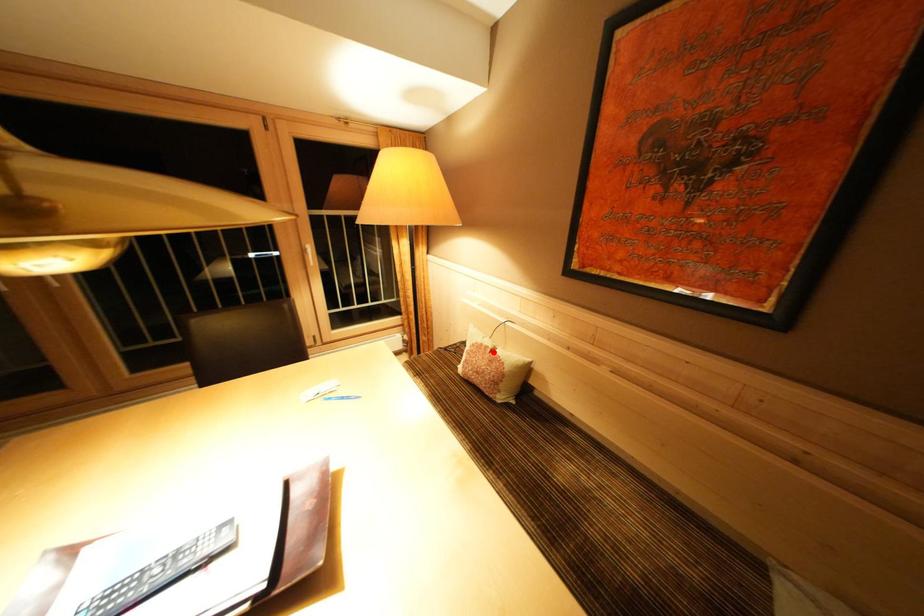
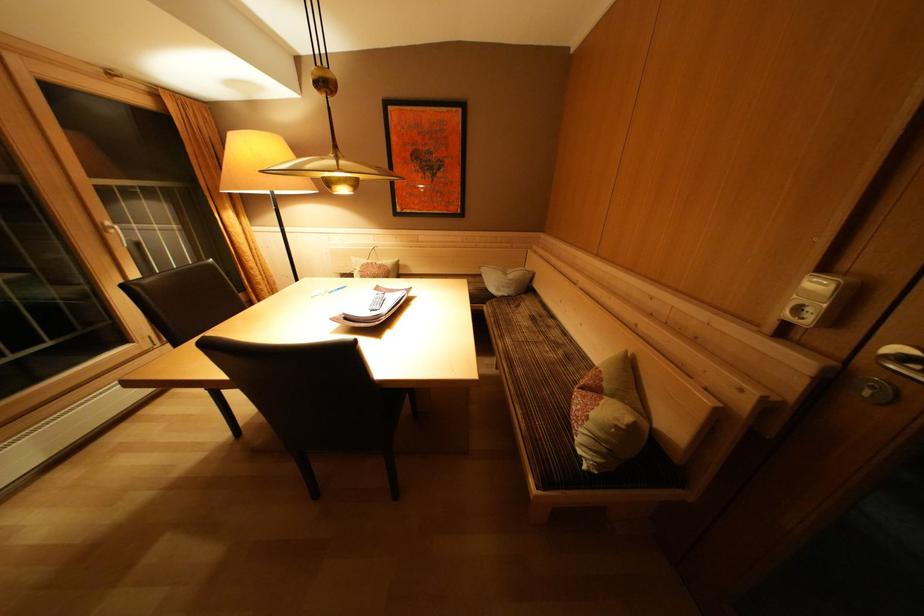
Question: I am providing you with two images of the same scene from different viewpoints. Image1 has a red point marked. In image2, the corresponding 3D location appears at what relative position? Reply with the corresponding letter.

Choices:
 (A) Closer
 (B) Farther

Answer: (A)